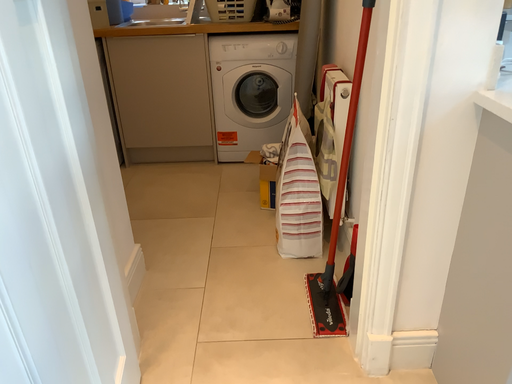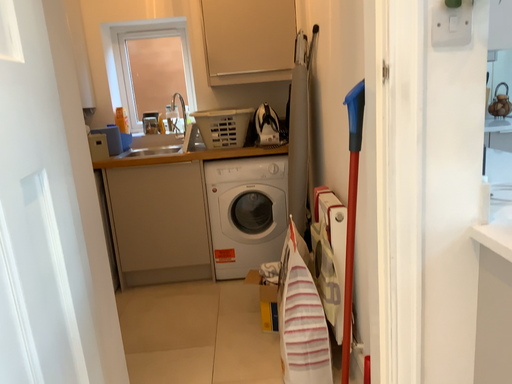
Question: Which way did the camera rotate in the video?

Choices:
 (A) rotated upward
 (B) rotated downward

Answer: (A)